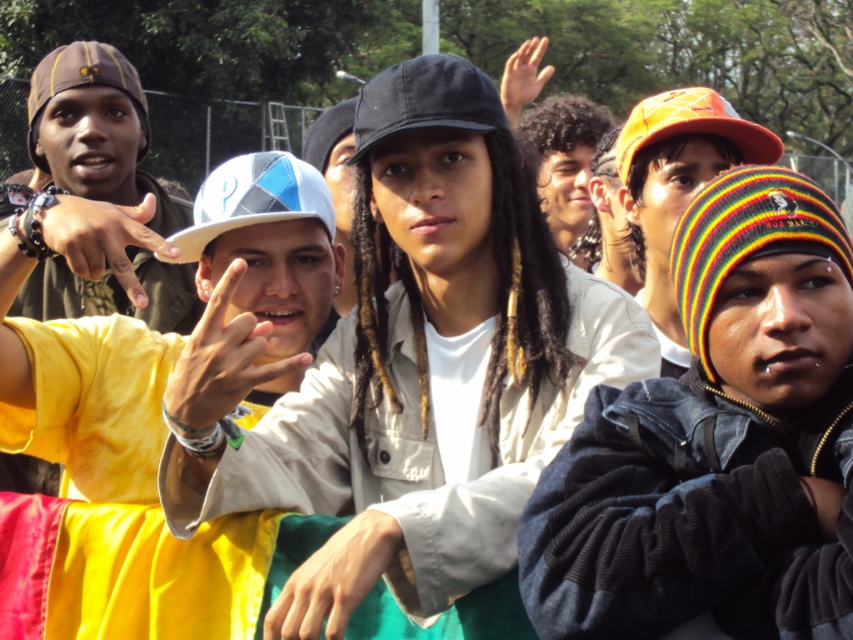
Question: Which of the following is the farthest from the observer?

Choices:
 (A) black fabric baseball cap at center
 (B) orange fabric baseball cap at upper right
 (C) skinny flesh at upper right
 (D) white matte baseball cap at center

Answer: (C)

Question: Considering the real-world distances, which object is closest to the matte brown beanie at left?

Choices:
 (A) yellow cotton shirt at left
 (B) orange fabric baseball cap at upper right

Answer: (A)

Question: Is matte brown beanie at left wider than black fabric baseball cap at center?

Choices:
 (A) no
 (B) yes

Answer: (B)

Question: Among these points, which one is nearest to the camera?

Choices:
 (A) (351, 426)
 (B) (21, 392)
 (C) (45, 216)

Answer: (C)

Question: Is striped knit beanie at right to the right of white matte baseball cap at center from the viewer's perspective?

Choices:
 (A) yes
 (B) no

Answer: (A)

Question: Is matte brown beanie at left above white matte baseball cap at center?

Choices:
 (A) no
 (B) yes

Answer: (B)